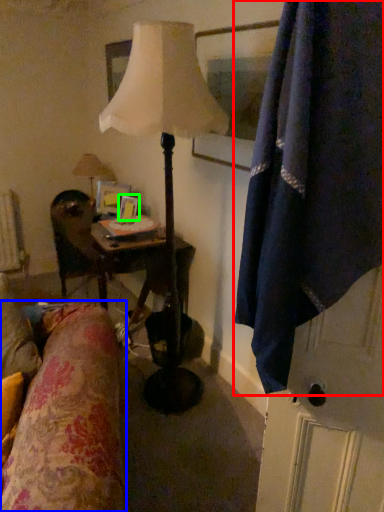
Question: Considering the real-world distances, which object is closest to curtain (highlighted by a red box)? bedding (highlighted by a blue box) or picture frame (highlighted by a green box).

Choices:
 (A) bedding
 (B) picture frame

Answer: (A)